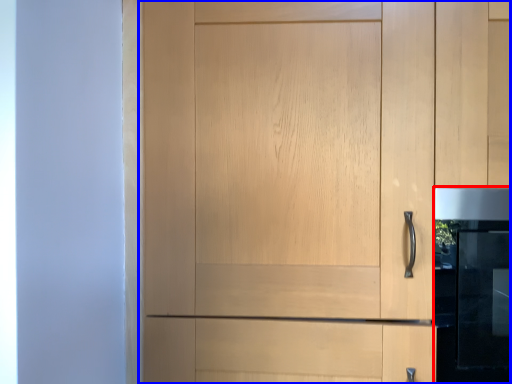
Question: Which object is further to the camera taking this photo, oven (highlighted by a red box) or cupboard (highlighted by a blue box)?

Choices:
 (A) oven
 (B) cupboard

Answer: (A)